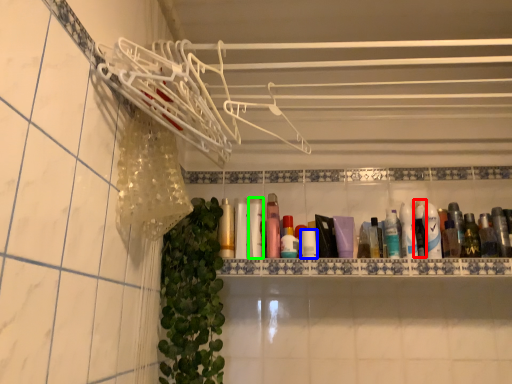
Question: Considering the real-world distances, which object is farthest from mouthwash (highlighted by a red box)? toiletry (highlighted by a blue box) or mouthwash (highlighted by a green box)?

Choices:
 (A) toiletry
 (B) mouthwash

Answer: (B)